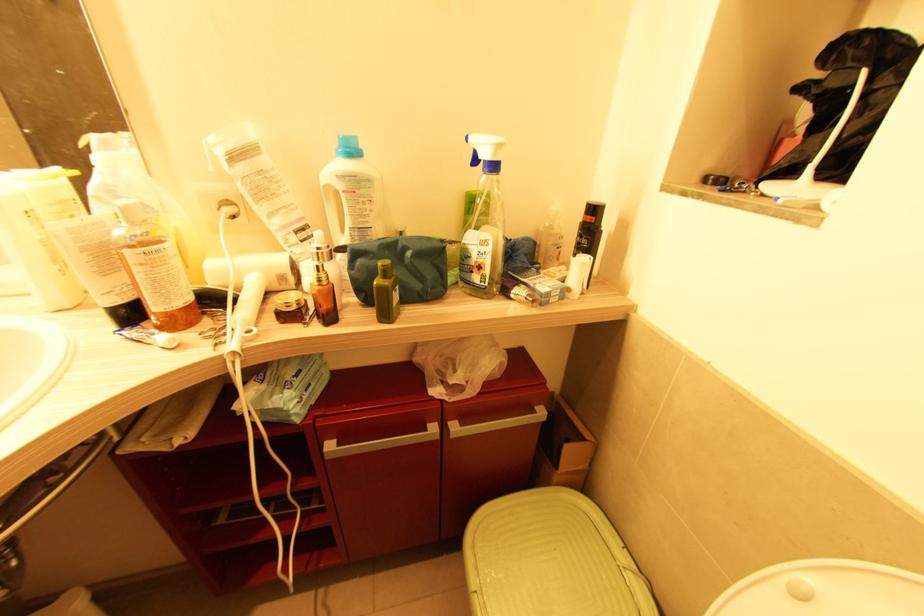
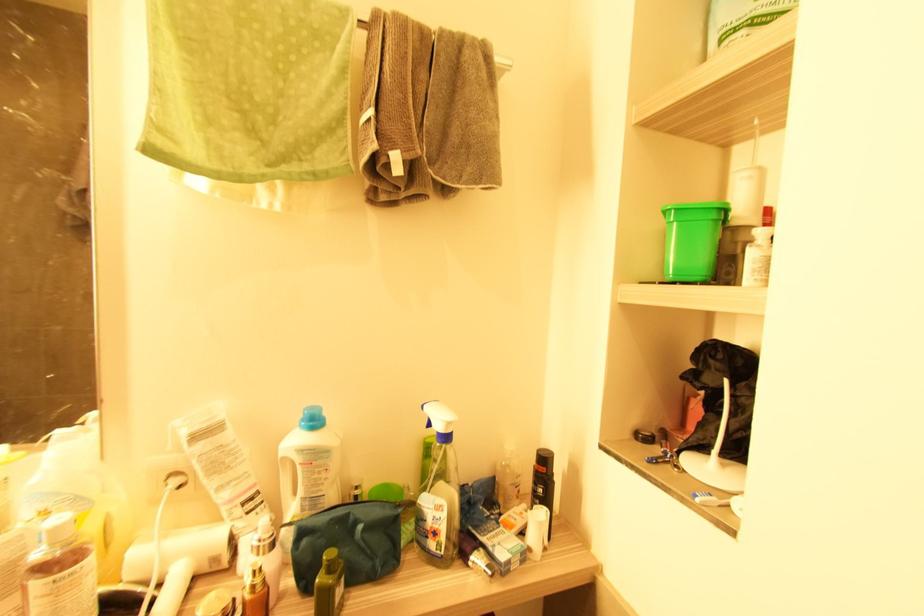
Question: The images are taken continuously from a first-person perspective. In which direction are you moving?

Choices:
 (A) Left
 (B) Right
 (C) Forward
 (D) Backward

Answer: (D)